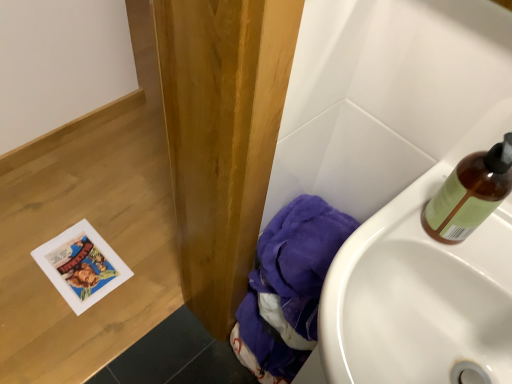
Locate an element on the screen. This screenshot has width=512, height=384. purple fabric at lower right is located at coordinates tap(288, 288).

The width and height of the screenshot is (512, 384). What are the coordinates of `translucent amber bottle at upper right` in the screenshot? It's located at (470, 194).

Based on the photo, how different are the orientations of translucent amber bottle at upper right and white glossy sink at lower right in degrees?

0.000472 degrees.

From the image's perspective, is translucent amber bottle at upper right located above white glossy sink at lower right?

Yes, from the image's perspective, translucent amber bottle at upper right is above white glossy sink at lower right.

Is translucent amber bottle at upper right in front of white glossy sink at lower right?

That is False.

Could white glossy sink at lower right be considered to be inside translucent amber bottle at upper right?

No, white glossy sink at lower right is located outside of translucent amber bottle at upper right.

Image resolution: width=512 pixels, height=384 pixels. What are the coordinates of `material below the translucent amber bottle at upper right (from the image's perspective)` in the screenshot? It's located at (288, 288).

From the image's perspective, is purple fabric at lower right above or below translucent amber bottle at upper right?

Based on their image positions, purple fabric at lower right is located beneath translucent amber bottle at upper right.

Is purple fabric at lower right inside the boundaries of translucent amber bottle at upper right, or outside?

purple fabric at lower right is not inside translucent amber bottle at upper right, it's outside.

From a real-world perspective, is purple fabric at lower right physically located above or below translucent amber bottle at upper right?

purple fabric at lower right is below translucent amber bottle at upper right.

Is white glossy sink at lower right thinner than translucent amber bottle at upper right?

Incorrect, the width of white glossy sink at lower right is not less than that of translucent amber bottle at upper right.

Is white glossy sink at lower right spatially inside translucent amber bottle at upper right, or outside of it?

white glossy sink at lower right cannot be found inside translucent amber bottle at upper right.

In the scene shown: Is white glossy sink at lower right positioned with its back to translucent amber bottle at upper right?

No, white glossy sink at lower right is not facing away from translucent amber bottle at upper right.

Is white glossy sink at lower right closer to camera compared to translucent amber bottle at upper right?

Yes, it is.

Is purple fabric at lower right at the back of white glossy sink at lower right?

white glossy sink at lower right does not have its back to purple fabric at lower right.

Identify the location of material located behind the white glossy sink at lower right. Image resolution: width=512 pixels, height=384 pixels. (288, 288).

Is white glossy sink at lower right positioned beyond the bounds of purple fabric at lower right?

Yes, white glossy sink at lower right is not within purple fabric at lower right.

Does white glossy sink at lower right have a smaller size compared to purple fabric at lower right?

Yes.

Which is further, (438, 207) or (285, 290)?

The point (285, 290) is farther.

From the picture: From a real-world perspective, is translucent amber bottle at upper right positioned under purple fabric at lower right based on gravity?

No, from a real-world perspective, translucent amber bottle at upper right is not below purple fabric at lower right.

From the image's perspective, is translucent amber bottle at upper right positioned above or below purple fabric at lower right?

From the image's perspective, translucent amber bottle at upper right appears above purple fabric at lower right.

Is translucent amber bottle at upper right outside of purple fabric at lower right?

That's correct, translucent amber bottle at upper right is outside of purple fabric at lower right.

Locate an element on the screen. The height and width of the screenshot is (384, 512). material below the white glossy sink at lower right (from the image's perspective) is located at coordinates (288, 288).

Is purple fabric at lower right directly adjacent to white glossy sink at lower right?

There is a gap between purple fabric at lower right and white glossy sink at lower right.

Which object is thinner, purple fabric at lower right or white glossy sink at lower right?

purple fabric at lower right is thinner.

Considering the relative positions of purple fabric at lower right and white glossy sink at lower right in the image provided, is purple fabric at lower right to the left or to the right of white glossy sink at lower right?

purple fabric at lower right is positioned on white glossy sink at lower right's left side.

Identify the location of sink located on the left of translucent amber bottle at upper right. This screenshot has height=384, width=512. (422, 287).

This screenshot has width=512, height=384. Identify the location of material behind the translucent amber bottle at upper right. coord(288,288).

Based on their spatial positions, is translucent amber bottle at upper right or white glossy sink at lower right further from purple fabric at lower right?

translucent amber bottle at upper right is further to purple fabric at lower right.

Consider the image. When comparing their distances from purple fabric at lower right, does white glossy sink at lower right or translucent amber bottle at upper right seem further?

translucent amber bottle at upper right is positioned further to the anchor purple fabric at lower right.

Estimate the real-world distances between objects in this image. Which object is further from white glossy sink at lower right, translucent amber bottle at upper right or purple fabric at lower right?

The object further to white glossy sink at lower right is purple fabric at lower right.

In the scene shown: Based on their spatial positions, is white glossy sink at lower right or purple fabric at lower right further from translucent amber bottle at upper right?

Based on the image, purple fabric at lower right appears to be further to translucent amber bottle at upper right.

From the image, which object appears to be farther from translucent amber bottle at upper right, purple fabric at lower right or white glossy sink at lower right?

The object further to translucent amber bottle at upper right is purple fabric at lower right.

Considering their positions, is purple fabric at lower right positioned further to white glossy sink at lower right than translucent amber bottle at upper right?

purple fabric at lower right lies further to white glossy sink at lower right than the other object.

At what (x,y) coordinates should I click in order to perform the action: click on bottle located between white glossy sink at lower right and purple fabric at lower right in the depth direction. Please return your answer as a coordinate pair (x, y). The image size is (512, 384). Looking at the image, I should click on (470, 194).